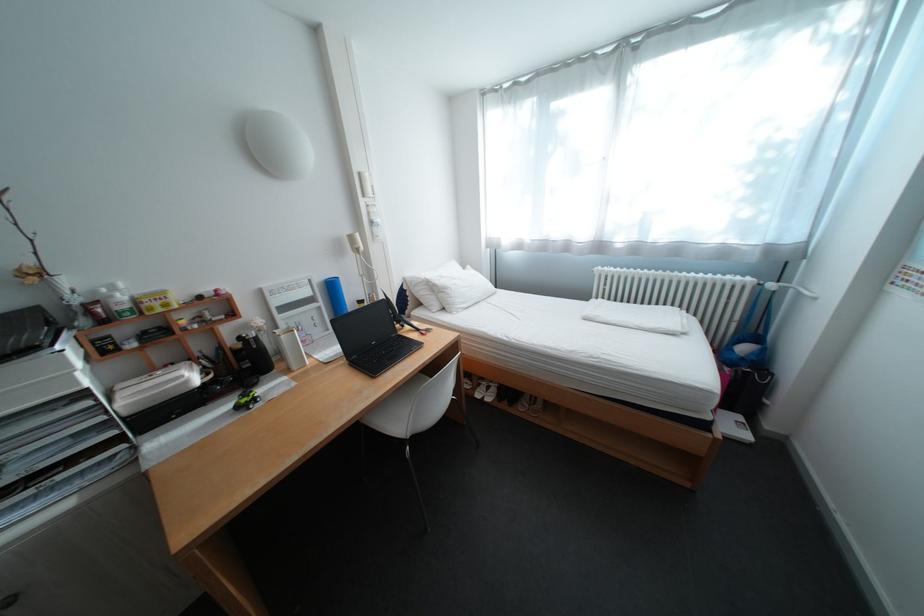
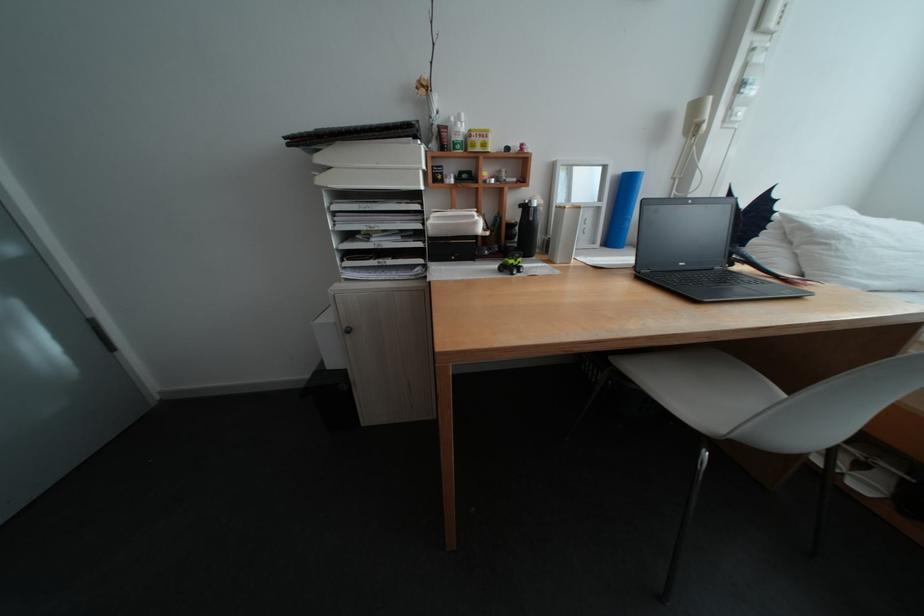
Where in the second image is the point corresponding to (98,306) from the first image?

(453, 128)